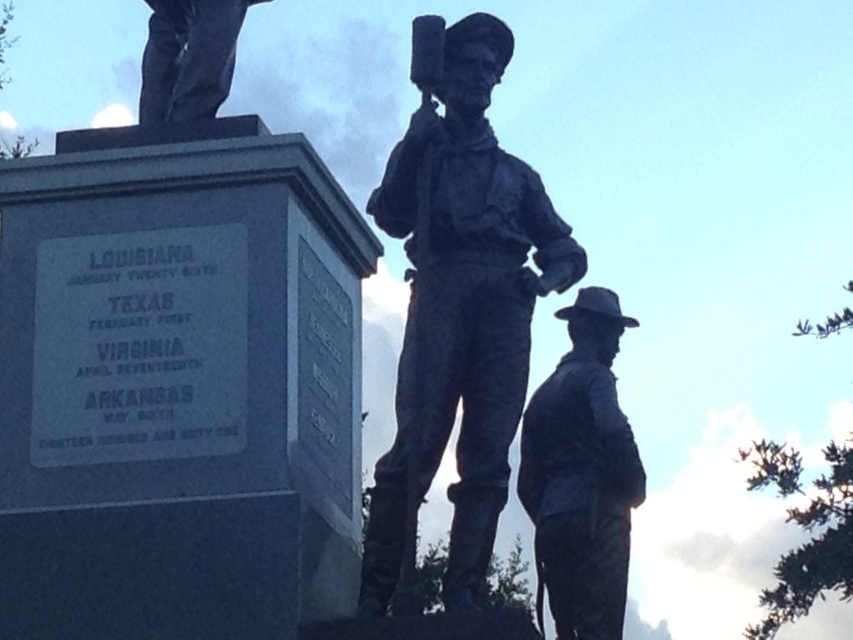
You are a visitor at the monument and want to take a photo of both the bronze statue at center and the polished bronze statue at upper left. Which statue will appear larger in your photo?

The bronze statue at center will appear larger in your photo because it is closer to the viewer than the polished bronze statue at upper left.

You are standing in front of the monument and want to take a photo of the bronze statue at center. Based on its position, where should you aim your camera?

The bronze statue at center is located at point (459, 304), so you should aim your camera towards that coordinate to capture it properly.

You are a tour guide explaining the monument to visitors. Pointing to the bronze statue at lower right and the polished bronze statue at upper left, you want to describe their positions. Which statue is located below the other?

The bronze statue at lower right is positioned under the polished bronze statue at upper left.